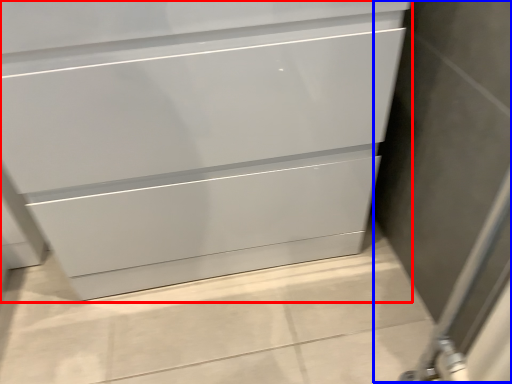
Question: Among these objects, which one is farthest to the camera, chest of drawers (highlighted by a red box) or screen door (highlighted by a blue box)?

Choices:
 (A) chest of drawers
 (B) screen door

Answer: (A)